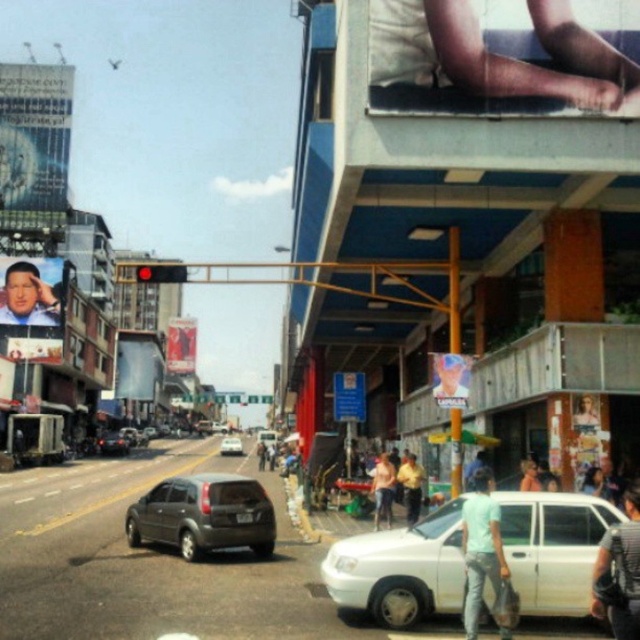
Question: Estimate the real-world distances between objects in this image. Which object is closer to the smooth skin face at upper left?

Choices:
 (A) metallic silver sign at center
 (B) light blue cotton shirt at lower right
 (C) metallic silver face at center
 (D) smooth skin legs at upper center

Answer: (C)

Question: Can you confirm if white matte sedan at lower center is positioned above smooth skin portrait at center?

Choices:
 (A) no
 (B) yes

Answer: (A)

Question: From the image, what is the correct spatial relationship of dark gray shirt at lower right in relation to metallic silver face at center?

Choices:
 (A) below
 (B) above

Answer: (A)

Question: Which point is farther from the camera taking this photo?

Choices:
 (A) (433, 92)
 (B) (209, 518)

Answer: (A)

Question: Which point is closer to the camera?

Choices:
 (A) smooth skin face at upper left
 (B) yellow shirt at center
 (C) dark gray shirt at lower right

Answer: (C)

Question: Observing the image, what is the correct spatial positioning of dark gray matte minivan at center-left in reference to smooth skin face at center?

Choices:
 (A) left
 (B) right

Answer: (A)